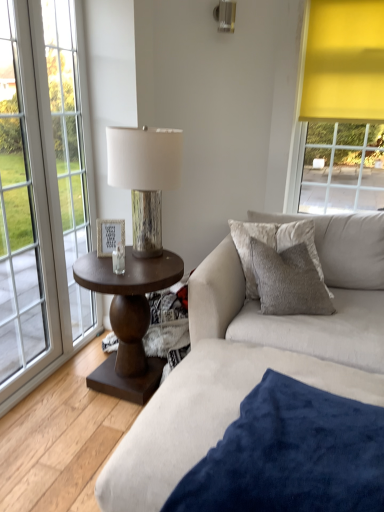
Question: Does white wood picture frame at center turn towards textured beige couch at center?

Choices:
 (A) yes
 (B) no

Answer: (B)

Question: Does white wood picture frame at center contain textured beige couch at center?

Choices:
 (A) no
 (B) yes

Answer: (A)

Question: From the image's perspective, is white wood picture frame at center located above textured beige couch at center?

Choices:
 (A) yes
 (B) no

Answer: (A)

Question: Is white wood picture frame at center directly adjacent to textured beige couch at center?

Choices:
 (A) yes
 (B) no

Answer: (B)

Question: Is white wood picture frame at center not close to textured beige couch at center?

Choices:
 (A) no
 (B) yes

Answer: (A)

Question: In terms of size, does dark wood side table at center appear bigger or smaller than wooden lampshade at center?

Choices:
 (A) small
 (B) big

Answer: (B)

Question: From the image's perspective, is dark wood side table at center located above or below wooden lampshade at center?

Choices:
 (A) below
 (B) above

Answer: (A)

Question: From a real-world perspective, relative to wooden lampshade at center, is dark wood side table at center vertically above or below?

Choices:
 (A) above
 (B) below

Answer: (B)

Question: Considering the positions of point (112, 290) and point (172, 144), is point (112, 290) closer or farther from the camera than point (172, 144)?

Choices:
 (A) closer
 (B) farther

Answer: (A)

Question: Considering their positions, is white glass window at left located in front of or behind velvet gray pillow at center?

Choices:
 (A) behind
 (B) front

Answer: (B)

Question: Looking at their shapes, would you say white glass window at left is wider or thinner than velvet gray pillow at center?

Choices:
 (A) wide
 (B) thin

Answer: (B)

Question: Considering the positions of white glass window at left and velvet gray pillow at center in the image, is white glass window at left taller or shorter than velvet gray pillow at center?

Choices:
 (A) short
 (B) tall

Answer: (B)

Question: Based on their sizes in the image, would you say white glass window at left is bigger or smaller than velvet gray pillow at center?

Choices:
 (A) small
 (B) big

Answer: (B)

Question: From a real-world perspective, relative to dark wood side table at center, is velvety blue blanket at lower right vertically above or below?

Choices:
 (A) below
 (B) above

Answer: (A)

Question: From the image's perspective, relative to dark wood side table at center, is velvety blue blanket at lower right above or below?

Choices:
 (A) above
 (B) below

Answer: (B)